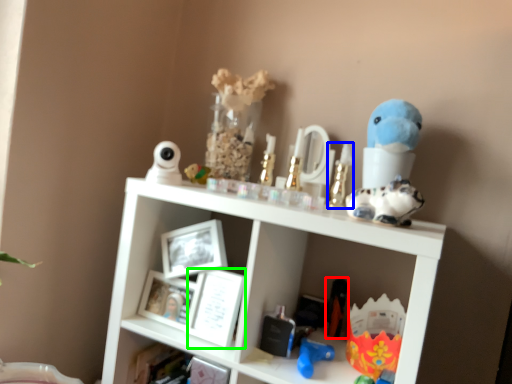
Question: Considering the real-world distances, which object is farthest from toy (highlighted by a red box)? toy (highlighted by a blue box) or picture frame (highlighted by a green box)?

Choices:
 (A) toy
 (B) picture frame

Answer: (B)